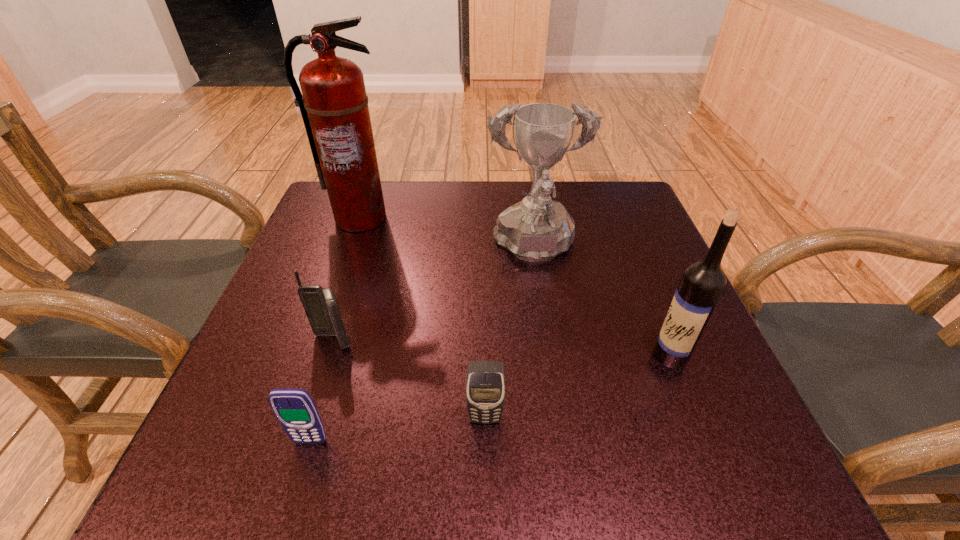
Locate an element on the screen. The height and width of the screenshot is (540, 960). free space located 0.080m on the label of the rightmost object is located at coordinates tap(610, 355).

The image size is (960, 540). I want to click on free space located on the label of the rightmost object, so click(493, 355).

Identify the location of vacant area situated on the keyboard of the farthest cellular telephone. (295, 460).

You are a GUI agent. You are given a task and a screenshot of the screen. Output one action in this format:
    pyautogui.click(x=<x>, y=<y>)
    Task: Click on the vacant space situated on the front face of the rightmost cellular telephone
    The image size is (960, 540).
    Given the screenshot: What is the action you would take?
    pyautogui.click(x=486, y=484)

Locate an element on the screen. This screenshot has height=540, width=960. fire extinguisher at the far edge is located at coordinates (334, 107).

Locate an element on the screen. The height and width of the screenshot is (540, 960). award that is positioned at the far edge is located at coordinates (535, 229).

What are the coordinates of `object present at the near edge` in the screenshot? It's located at (294, 408).

The image size is (960, 540). Find the location of `fire extinguisher that is at the left edge`. fire extinguisher that is at the left edge is located at coordinates (334, 107).

Find the location of `object at the right edge`. object at the right edge is located at coordinates (703, 282).

Locate an element on the screen. object located in the far left corner section of the desktop is located at coordinates (334, 107).